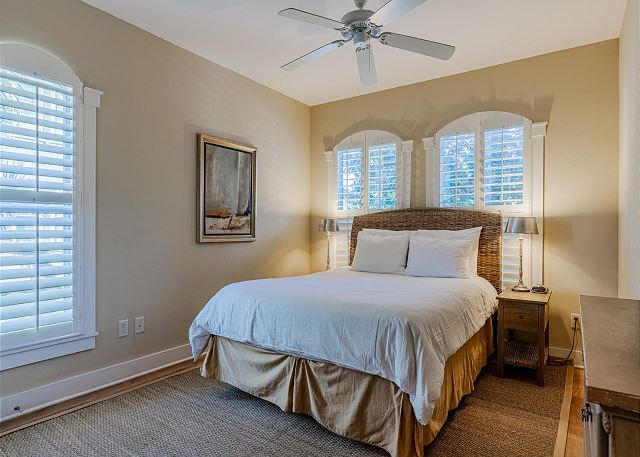
This screenshot has width=640, height=457. I want to click on wooden blades on ceiling fan, so click(299, 20), click(378, 10), click(402, 37), click(367, 62), click(321, 53).